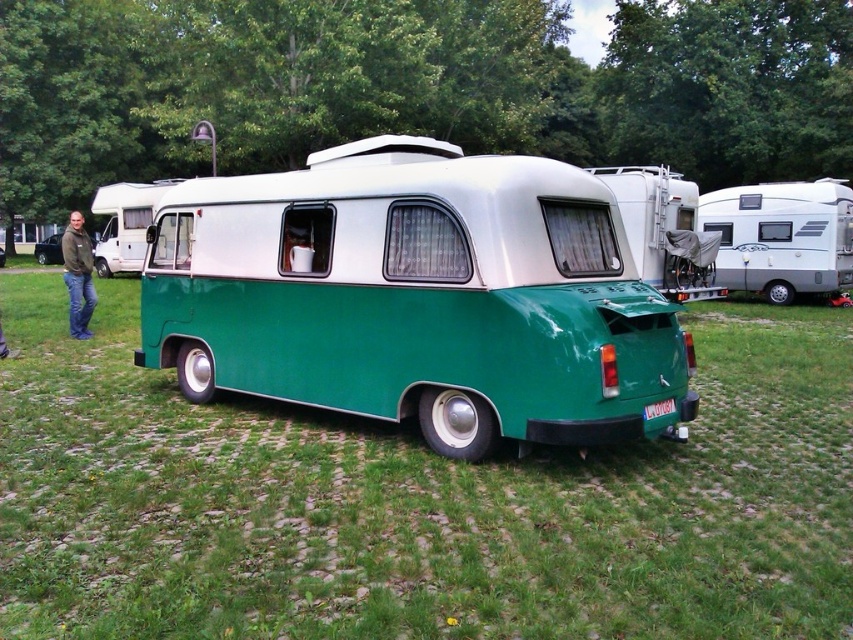
You are a delivery person needing to park your vehicle between the green matte recreational vehicle at center and the white plastic camper van at left. Can you fit your truck that is 15 meters long in the space between them?

The distance between the green matte recreational vehicle at center and the white plastic camper van at left is 16.17 meters. Since your truck is 15 meters long, it can fit in the space between them as there is enough room.

You are standing in front of the vintage camper van and notice two points marked on the ground. The first point is at coordinate point (517, 371) and the second is at point (62, 275). Which point is closer to your current position?

Point (517, 371) is closer to the camera than point (62, 275), so the first point is closer to your current position.